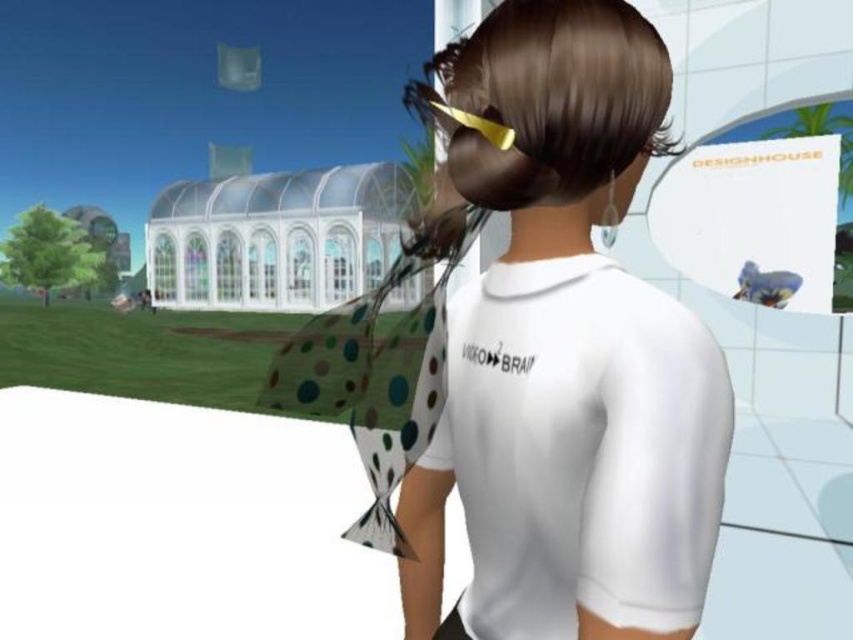
Is white matte shirt at center taller than shiny gold hair clip at upper center?

Correct, white matte shirt at center is much taller as shiny gold hair clip at upper center.

Which of these two, white matte shirt at center or shiny gold hair clip at upper center, stands taller?

white matte shirt at center is taller.

Identify the location of white matte shirt at center. (581, 449).